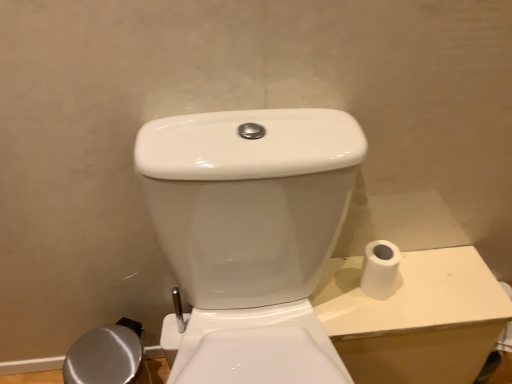
Locate an element on the screen. The width and height of the screenshot is (512, 384). vacant space to the right of white matte toilet paper at right is located at coordinates (437, 275).